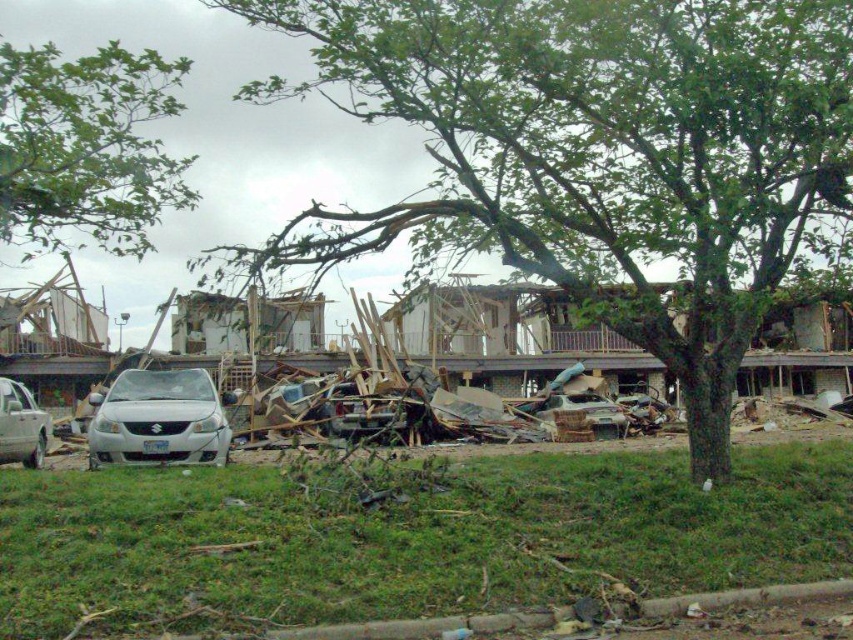
Question: Where is white matte car at lower left located in relation to rusty metallic car at center in the image?

Choices:
 (A) right
 (B) left

Answer: (B)

Question: Does white matte car at lower left appear under rusty metallic car at center?

Choices:
 (A) no
 (B) yes

Answer: (A)

Question: Which object is farther from the camera taking this photo?

Choices:
 (A) green grass at lower center
 (B) green leafy tree at upper left

Answer: (B)

Question: Which of the following is the farthest from the observer?

Choices:
 (A) green leafy tree at center
 (B) rusty metallic car at center
 (C) green grass at lower center

Answer: (B)

Question: Which object is farther from the camera taking this photo?

Choices:
 (A) green grass at lower center
 (B) rusty metallic car at center
 (C) white matte car at lower left

Answer: (B)

Question: Does green leafy tree at upper left have a larger size compared to white matte car at lower left?

Choices:
 (A) yes
 (B) no

Answer: (A)